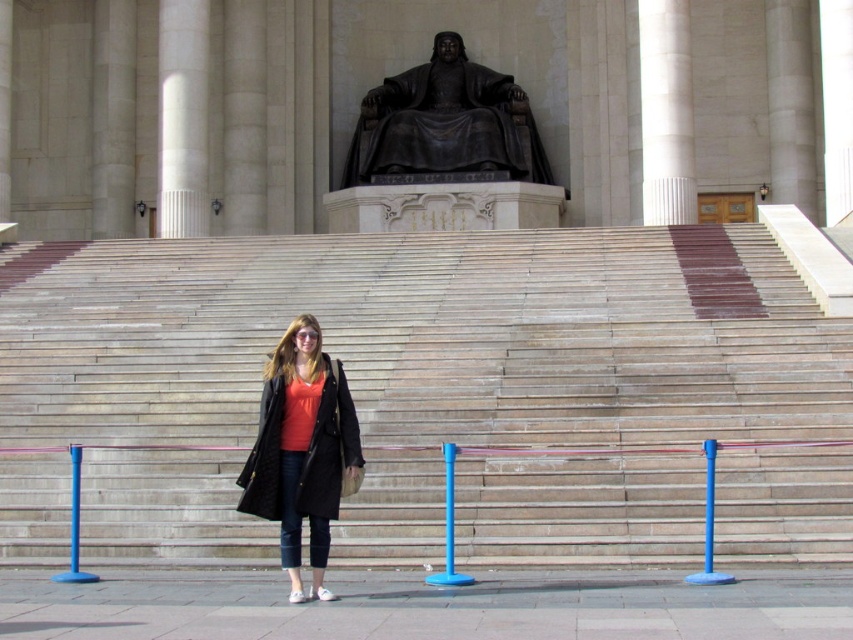
Which is in front, point (526, 259) or point (306, 387)?

Point (306, 387)

Which is behind, point (575, 268) or point (318, 577)?

The point (575, 268) is behind.

The width and height of the screenshot is (853, 640). I want to click on wooden stairs at center, so click(428, 349).

Is point (434, 83) farther from camera compared to point (657, 20)?

Yes, it is.

Is black polished stone statue at upper center below white marble column at upper center?

No, black polished stone statue at upper center is not below white marble column at upper center.

Between point (403, 128) and point (672, 40), which one is positioned behind?

The point (403, 128) is more distant.

Identify the location of black polished stone statue at upper center. (445, 125).

Which is above, wooden stairs at center or white marble column at upper center?

white marble column at upper center

Between point (526, 548) and point (654, 193), which one is positioned in front?

Point (526, 548) is in front.

Image resolution: width=853 pixels, height=640 pixels. Identify the location of wooden stairs at center. (428, 349).